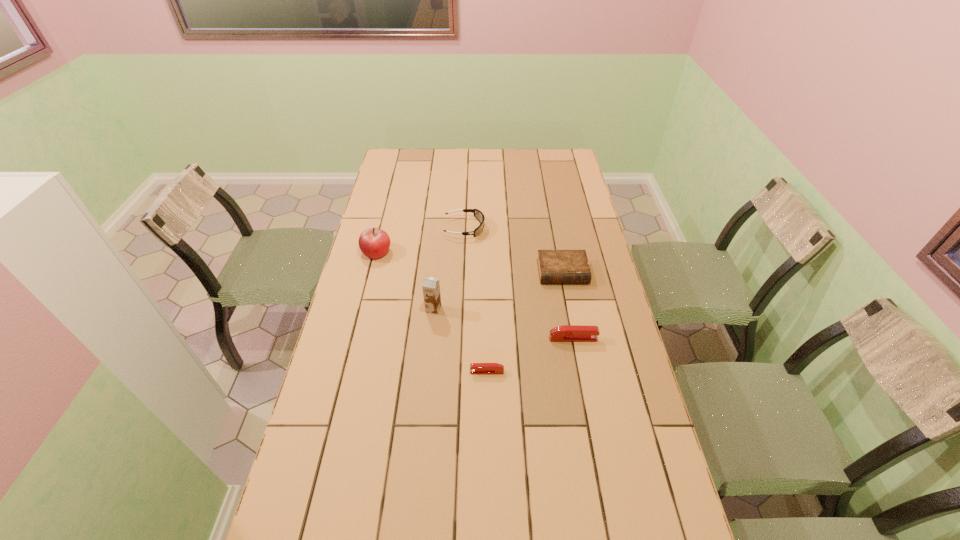
The height and width of the screenshot is (540, 960). In order to click on vacant spot to place a stapler on the left in this screenshot , I will do `click(390, 409)`.